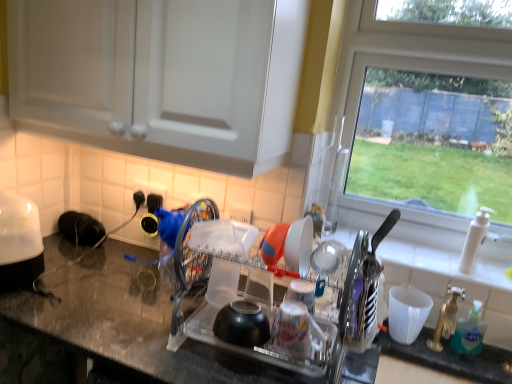
The width and height of the screenshot is (512, 384). Identify the location of vacant space that is in between white glossy toaster at left and transparent plastic dish rack at center. (98, 309).